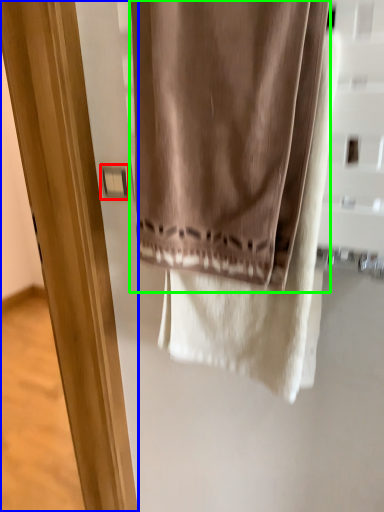
Question: Considering the real-world distances, which object is farthest from light switch (highlighted by a red box)? screen door (highlighted by a blue box) or curtain (highlighted by a green box)?

Choices:
 (A) screen door
 (B) curtain

Answer: (A)